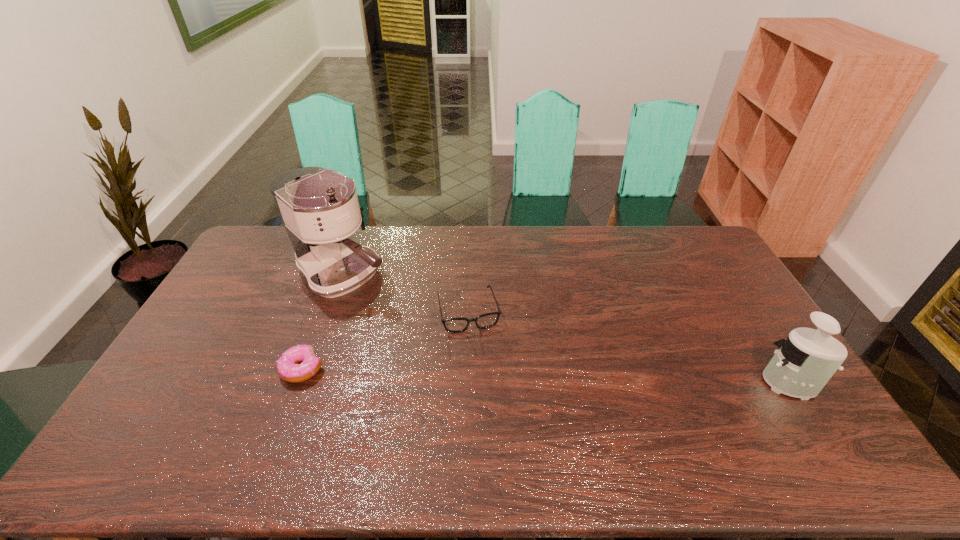
The width and height of the screenshot is (960, 540). Find the location of `vacant region at the near left corner of the desktop`. vacant region at the near left corner of the desktop is located at coordinates (180, 418).

Where is `free space at the far right corner of the desktop`? free space at the far right corner of the desktop is located at coordinates (695, 234).

Locate an element on the screen. This screenshot has height=540, width=960. empty space between the doughnut and the third tallest object is located at coordinates [x=385, y=340].

Identify the location of empty space that is in between the third tallest object and the rightmost object. (627, 346).

The height and width of the screenshot is (540, 960). Find the location of `empty space that is in between the coffee maker and the rightmost object`. empty space that is in between the coffee maker and the rightmost object is located at coordinates (564, 328).

This screenshot has height=540, width=960. Identify the location of vacant space in between the juicer and the doughnut. (543, 375).

This screenshot has width=960, height=540. In order to click on free space between the spectacles and the second tallest object in this screenshot , I will do `click(627, 346)`.

Locate an element on the screen. The image size is (960, 540). free space between the tallest object and the doughnut is located at coordinates (324, 322).

Where is `free space between the spectacles and the shortest object`? free space between the spectacles and the shortest object is located at coordinates (385, 340).

The width and height of the screenshot is (960, 540). I want to click on free space between the coffee maker and the juicer, so click(x=564, y=328).